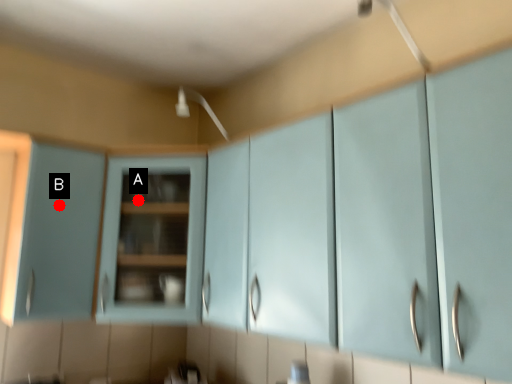
Question: Two points are circled on the image, labeled by A and B beside each circle. Which of the following is the farthest from the observer?

Choices:
 (A) A is further
 (B) B is further

Answer: (A)